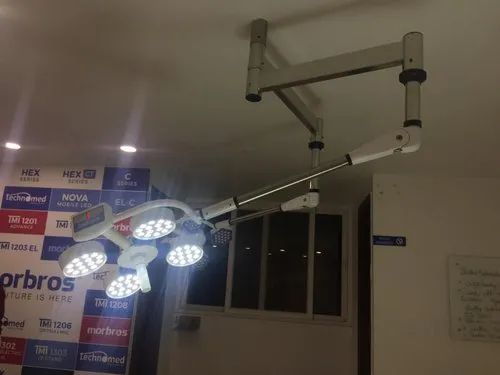
Find the location of a particular element. lighting device is located at coordinates (159, 229).